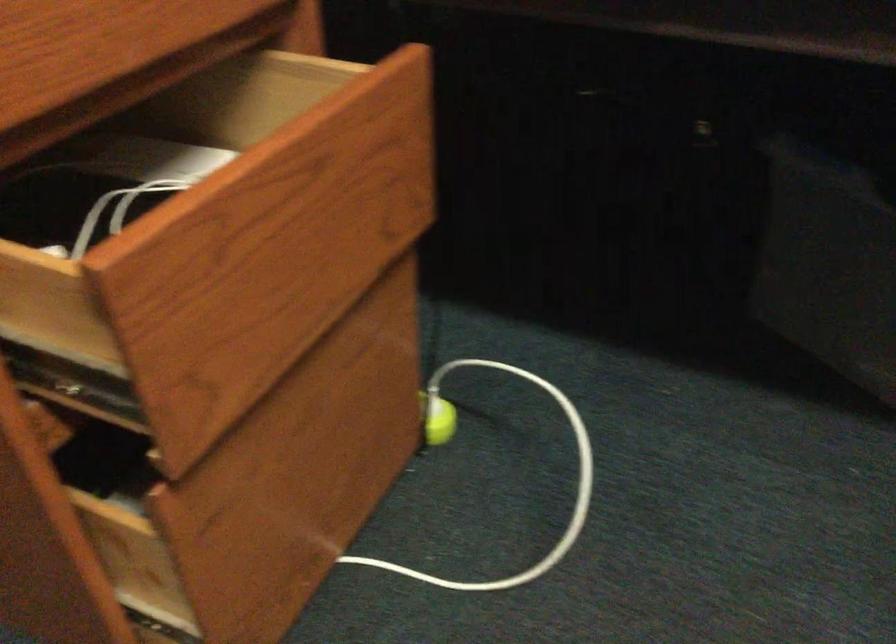
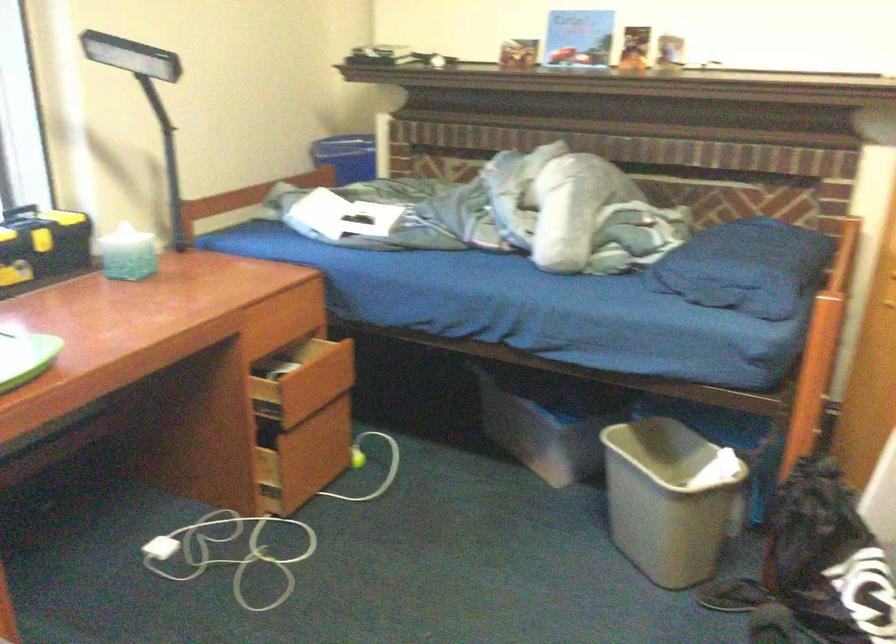
Question: Which direction would the cameraman need to move to produce the second image? Reply with the corresponding letter.

Choices:
 (A) Left
 (B) Right
 (C) Forward
 (D) Backward

Answer: (D)